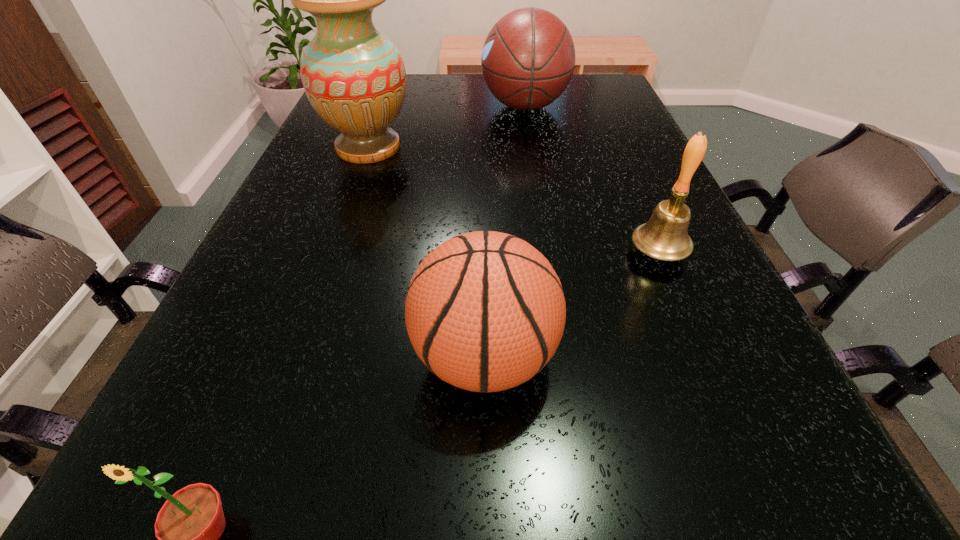
I want to click on vase, so click(x=354, y=77).

Find the location of a particular element. This screenshot has width=960, height=540. the farther basketball is located at coordinates (528, 59).

You are a GUI agent. You are given a task and a screenshot of the screen. Output one action in this format:
    pyautogui.click(x=<x>, y=<y>)
    Task: Click on the bell
    
    Given the screenshot: What is the action you would take?
    pyautogui.click(x=665, y=236)

Identify the location of the third nearest object. The image size is (960, 540). (665, 236).

What are the coordinates of `the nearer basketball` in the screenshot? It's located at (485, 311).

Where is `the shorter basketball`? the shorter basketball is located at coordinates (485, 311).

This screenshot has height=540, width=960. Identify the location of vacant point located 0.070m on the back of the vase. (380, 114).

Find the location of a particular element. vacant space located on the left of the farther basketball is located at coordinates (366, 106).

Find the location of a particular element. The image size is (960, 540). vacant area situated on the left of the rightmost object is located at coordinates (468, 253).

This screenshot has width=960, height=540. What are the coordinates of `vacant space located 0.230m on the side where the inflation valve is located` in the screenshot? It's located at (253, 357).